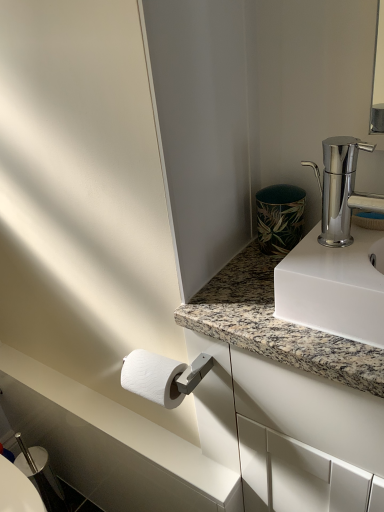
Question: From a real-world perspective, is polished chrome faucet at upper right under green leaf-patterned ceramic at upper right?

Choices:
 (A) no
 (B) yes

Answer: (A)

Question: Considering the relative positions of polished chrome faucet at upper right and green leaf-patterned ceramic at upper right in the image provided, is polished chrome faucet at upper right to the right of green leaf-patterned ceramic at upper right from the viewer's perspective?

Choices:
 (A) yes
 (B) no

Answer: (A)

Question: Considering the relative sizes of polished chrome faucet at upper right and green leaf-patterned ceramic at upper right in the image provided, is polished chrome faucet at upper right taller than green leaf-patterned ceramic at upper right?

Choices:
 (A) yes
 (B) no

Answer: (A)

Question: Is there a large distance between polished chrome faucet at upper right and green leaf-patterned ceramic at upper right?

Choices:
 (A) yes
 (B) no

Answer: (B)

Question: Does polished chrome faucet at upper right have a smaller size compared to green leaf-patterned ceramic at upper right?

Choices:
 (A) yes
 (B) no

Answer: (B)

Question: In terms of size, does granite at upper right appear bigger or smaller than green leaf-patterned ceramic at upper right?

Choices:
 (A) big
 (B) small

Answer: (A)

Question: In terms of width, does granite at upper right look wider or thinner when compared to green leaf-patterned ceramic at upper right?

Choices:
 (A) wide
 (B) thin

Answer: (A)

Question: From a real-world perspective, relative to green leaf-patterned ceramic at upper right, is granite at upper right vertically above or below?

Choices:
 (A) below
 (B) above

Answer: (A)

Question: Is granite at upper right to the left or to the right of green leaf-patterned ceramic at upper right in the image?

Choices:
 (A) left
 (B) right

Answer: (B)

Question: In the image, is green leaf-patterned ceramic at upper right positioned in front of or behind white marble countertop at lower left?

Choices:
 (A) behind
 (B) front

Answer: (B)

Question: In terms of size, does green leaf-patterned ceramic at upper right appear bigger or smaller than white marble countertop at lower left?

Choices:
 (A) big
 (B) small

Answer: (A)

Question: From a real-world perspective, is green leaf-patterned ceramic at upper right above or below white marble countertop at lower left?

Choices:
 (A) below
 (B) above

Answer: (B)

Question: From the image's perspective, is green leaf-patterned ceramic at upper right located above or below white marble countertop at lower left?

Choices:
 (A) below
 (B) above

Answer: (B)

Question: Considering the positions of white textured toilet paper at lower left and white marble countertop at lower left in the image, is white textured toilet paper at lower left wider or thinner than white marble countertop at lower left?

Choices:
 (A) thin
 (B) wide

Answer: (B)

Question: Relative to white marble countertop at lower left, is white textured toilet paper at lower left in front or behind?

Choices:
 (A) front
 (B) behind

Answer: (A)